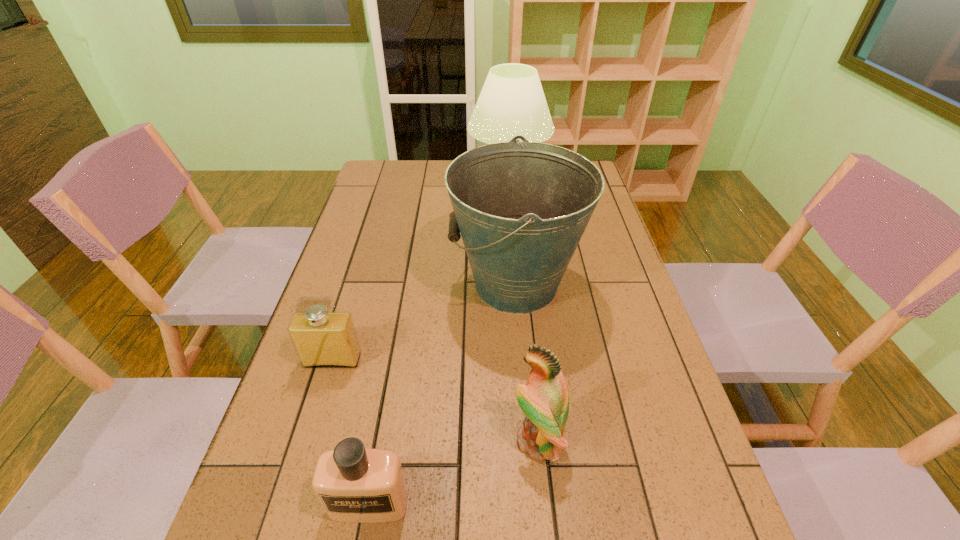
Locate an element on the screen. object that is the third closest one to the bucket is located at coordinates (512, 102).

Where is `the second closest object to the fourth nearest object`? the second closest object to the fourth nearest object is located at coordinates (544, 399).

Identify the location of free space that satisfies the following two spatial constraints: 1. with the handle on opposite sides of the second farthest object; 2. on the front label of the nearest object. (536, 503).

This screenshot has width=960, height=540. I want to click on vacant position in the image that satisfies the following two spatial constraints: 1. with the handle on opposite sides of the bucket; 2. on the front-facing side of the leftmost object, so click(522, 360).

Locate an element on the screen. This screenshot has width=960, height=540. free point that satisfies the following two spatial constraints: 1. with the handle on opposite sides of the second farthest object; 2. on the front-facing side of the leftmost object is located at coordinates (522, 360).

What are the coordinates of `vacant space that satisfies the following two spatial constraints: 1. with the handle on opposite sides of the second farthest object; 2. on the front-facing side of the left perfume` in the screenshot? It's located at (522, 360).